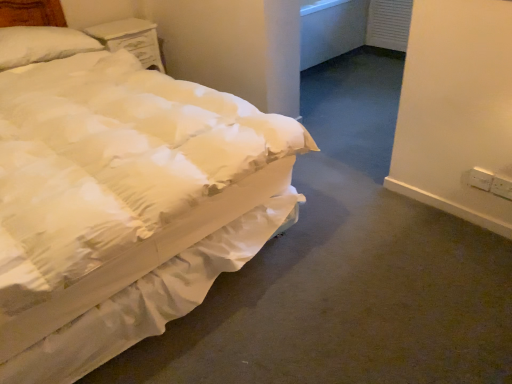
Measure the distance between point (485, 173) and camera.

Point (485, 173) is 1.86 meters from camera.

In order to click on white plastic electric outlet at lower right, which ranks as the second electric outlet in left-to-right order in this screenshot , I will do `click(502, 186)`.

Image resolution: width=512 pixels, height=384 pixels. What do you see at coordinates (124, 205) in the screenshot? I see `white quilted fabric bed at left` at bounding box center [124, 205].

Locate an element on the screen. This screenshot has width=512, height=384. white plastic electric outlet at right, arranged as the second electric outlet when viewed from the right is located at coordinates (480, 178).

Between white soft pillow at upper left and white quilted fabric bed at left, which one has less height?

white soft pillow at upper left.

Does white soft pillow at upper left contain white quilted fabric bed at left?

No, white soft pillow at upper left does not contain white quilted fabric bed at left.

Who is smaller, white soft pillow at upper left or white quilted fabric bed at left?

With smaller size is white soft pillow at upper left.

Considering the sizes of white soft pillow at upper left and white quilted fabric bed at left in the image, is white soft pillow at upper left wider or thinner than white quilted fabric bed at left?

Considering their sizes, white soft pillow at upper left looks slimmer than white quilted fabric bed at left.

Are white quilted fabric bed at left and white soft pillow at upper left far apart?

No, white quilted fabric bed at left is not far from white soft pillow at upper left.

Identify the location of pillow above the white quilted fabric bed at left (from the image's perspective). The image size is (512, 384). (41, 44).

Is white soft pillow at upper left at the back of white quilted fabric bed at left?

Yes, white quilted fabric bed at left's orientation is away from white soft pillow at upper left.

Is the depth of white quilted fabric bed at left greater than that of white soft pillow at upper left?

No, white quilted fabric bed at left is closer to the camera.

In the image, there is a white plastic electric outlet at right, placed as the first electric outlet when sorted from left to right. Identify the location of electric outlet below it (from a real-world perspective). This screenshot has width=512, height=384. (502, 186).

Does white plastic electric outlet at right, arranged as the second electric outlet when viewed from the right, come behind white plastic electric outlet at lower right, which is the first electric outlet in right-to-left order?

Yes, the depth of white plastic electric outlet at right, arranged as the second electric outlet when viewed from the right, is greater than that of white plastic electric outlet at lower right, which is the first electric outlet in right-to-left order.

Is white plastic electric outlet at right, placed as the first electric outlet when sorted from left to right, facing towards white plastic electric outlet at lower right, which is the first electric outlet in right-to-left order?

No.

Could you measure the distance between white plastic electric outlet at right, arranged as the second electric outlet when viewed from the right, and white plastic electric outlet at lower right, which ranks as the second electric outlet in left-to-right order?

white plastic electric outlet at right, arranged as the second electric outlet when viewed from the right, is 5.39 centimeters from white plastic electric outlet at lower right, which ranks as the second electric outlet in left-to-right order.

Between white quilted fabric bed at left and white plastic electric outlet at lower right, which is the first electric outlet in right-to-left order, which one appears on the right side from the viewer's perspective?

Positioned to the right is white plastic electric outlet at lower right, which is the first electric outlet in right-to-left order.

Which object is wider, white quilted fabric bed at left or white plastic electric outlet at lower right, which ranks as the second electric outlet in left-to-right order?

white quilted fabric bed at left.

Is white quilted fabric bed at left aimed at white plastic electric outlet at lower right, which ranks as the second electric outlet in left-to-right order?

No, white quilted fabric bed at left does not turn towards white plastic electric outlet at lower right, which ranks as the second electric outlet in left-to-right order.

Where is `bed above the white plastic electric outlet at lower right, which is the first electric outlet in right-to-left order (from a real-world perspective)`? This screenshot has width=512, height=384. bed above the white plastic electric outlet at lower right, which is the first electric outlet in right-to-left order (from a real-world perspective) is located at coordinates (124, 205).

How different are the orientations of white plastic electric outlet at lower right, which ranks as the second electric outlet in left-to-right order, and white quilted fabric bed at left in degrees?

They differ by 90.9 degrees in their facing directions.

Looking at this image, relative to white quilted fabric bed at left, is white plastic electric outlet at lower right, which ranks as the second electric outlet in left-to-right order, in front or behind?

Visually, white plastic electric outlet at lower right, which ranks as the second electric outlet in left-to-right order, is located behind white quilted fabric bed at left.

Is white plastic electric outlet at lower right, which is the first electric outlet in right-to-left order, at the right side of white quilted fabric bed at left?

Indeed, white plastic electric outlet at lower right, which is the first electric outlet in right-to-left order, is positioned on the right side of white quilted fabric bed at left.

In the scene shown: Measure the distance from white painted wood nightstand at upper left to white plastic electric outlet at lower right, which is the first electric outlet in right-to-left order.

white painted wood nightstand at upper left and white plastic electric outlet at lower right, which is the first electric outlet in right-to-left order, are 7.93 feet apart.

Based on the photo, is white painted wood nightstand at upper left far from white plastic electric outlet at lower right, which is the first electric outlet in right-to-left order?

Yes, white painted wood nightstand at upper left and white plastic electric outlet at lower right, which is the first electric outlet in right-to-left order, are located far from each other.

Considering the positions of objects white painted wood nightstand at upper left and white plastic electric outlet at lower right, which is the first electric outlet in right-to-left order, in the image provided, who is more to the left, white painted wood nightstand at upper left or white plastic electric outlet at lower right, which is the first electric outlet in right-to-left order,?

From the viewer's perspective, white painted wood nightstand at upper left appears more on the left side.

Which object is thinner, white painted wood nightstand at upper left or white plastic electric outlet at lower right, which is the first electric outlet in right-to-left order?

With smaller width is white plastic electric outlet at lower right, which is the first electric outlet in right-to-left order.

From the image's perspective, is white soft pillow at upper left above white plastic electric outlet at lower right, which ranks as the second electric outlet in left-to-right order?

Indeed, from the image's perspective, white soft pillow at upper left is shown above white plastic electric outlet at lower right, which ranks as the second electric outlet in left-to-right order.

Is white soft pillow at upper left not inside white plastic electric outlet at lower right, which ranks as the second electric outlet in left-to-right order?

Yes.

Based on the photo, between white soft pillow at upper left and white plastic electric outlet at lower right, which is the first electric outlet in right-to-left order, which one has less height?

white plastic electric outlet at lower right, which is the first electric outlet in right-to-left order.

Where is `bed below the white soft pillow at upper left (from the image's perspective)`? This screenshot has height=384, width=512. bed below the white soft pillow at upper left (from the image's perspective) is located at coordinates (124, 205).

The height and width of the screenshot is (384, 512). I want to click on pillow behind the white quilted fabric bed at left, so click(41, 44).

Considering their positions, is white soft pillow at upper left positioned closer to white plastic electric outlet at lower right, which ranks as the second electric outlet in left-to-right order, than white quilted fabric bed at left?

white quilted fabric bed at left is closer to white plastic electric outlet at lower right, which ranks as the second electric outlet in left-to-right order.

From the image, which object appears to be nearer to white plastic electric outlet at lower right, which ranks as the second electric outlet in left-to-right order, white painted wood nightstand at upper left or white plastic electric outlet at right, placed as the first electric outlet when sorted from left to right?

Among the two, white plastic electric outlet at right, placed as the first electric outlet when sorted from left to right, is located nearer to white plastic electric outlet at lower right, which ranks as the second electric outlet in left-to-right order.

Estimate the real-world distances between objects in this image. Which object is further from white plastic electric outlet at lower right, which is the first electric outlet in right-to-left order, white plastic electric outlet at right, placed as the first electric outlet when sorted from left to right, or white painted wood nightstand at upper left?

white painted wood nightstand at upper left is further to white plastic electric outlet at lower right, which is the first electric outlet in right-to-left order.

Estimate the real-world distances between objects in this image. Which object is closer to white quilted fabric bed at left, white plastic electric outlet at lower right, which ranks as the second electric outlet in left-to-right order, or white painted wood nightstand at upper left?

white painted wood nightstand at upper left.

Which object lies nearer to the anchor point white quilted fabric bed at left, white plastic electric outlet at lower right, which is the first electric outlet in right-to-left order, or white plastic electric outlet at right, placed as the first electric outlet when sorted from left to right?

white plastic electric outlet at right, placed as the first electric outlet when sorted from left to right, is closer to white quilted fabric bed at left.

From the image, which object appears to be farther from white plastic electric outlet at right, arranged as the second electric outlet when viewed from the right, white painted wood nightstand at upper left or white soft pillow at upper left?

white soft pillow at upper left is positioned further to the anchor white plastic electric outlet at right, arranged as the second electric outlet when viewed from the right.

From the picture: Estimate the real-world distances between objects in this image. Which object is closer to white plastic electric outlet at right, arranged as the second electric outlet when viewed from the right, white soft pillow at upper left or white painted wood nightstand at upper left?

white painted wood nightstand at upper left is closer to white plastic electric outlet at right, arranged as the second electric outlet when viewed from the right.

Based on their spatial positions, is white quilted fabric bed at left or white plastic electric outlet at right, placed as the first electric outlet when sorted from left to right, closer to white plastic electric outlet at lower right, which is the first electric outlet in right-to-left order?

white plastic electric outlet at right, placed as the first electric outlet when sorted from left to right, lies closer to white plastic electric outlet at lower right, which is the first electric outlet in right-to-left order, than the other object.

At what (x,y) coordinates should I click in order to perform the action: click on bed between white painted wood nightstand at upper left and white plastic electric outlet at right, placed as the first electric outlet when sorted from left to right. Please return your answer as a coordinate pair (x, y). This screenshot has height=384, width=512. Looking at the image, I should click on (124, 205).

Locate an element on the screen. nightstand situated between white soft pillow at upper left and white plastic electric outlet at lower right, which ranks as the second electric outlet in left-to-right order, from left to right is located at coordinates (131, 39).

Locate an element on the screen. Image resolution: width=512 pixels, height=384 pixels. bed located between white soft pillow at upper left and white plastic electric outlet at right, arranged as the second electric outlet when viewed from the right, in the left-right direction is located at coordinates (124, 205).

The width and height of the screenshot is (512, 384). What are the coordinates of `pillow between white quilted fabric bed at left and white painted wood nightstand at upper left along the z-axis` in the screenshot? It's located at (41, 44).